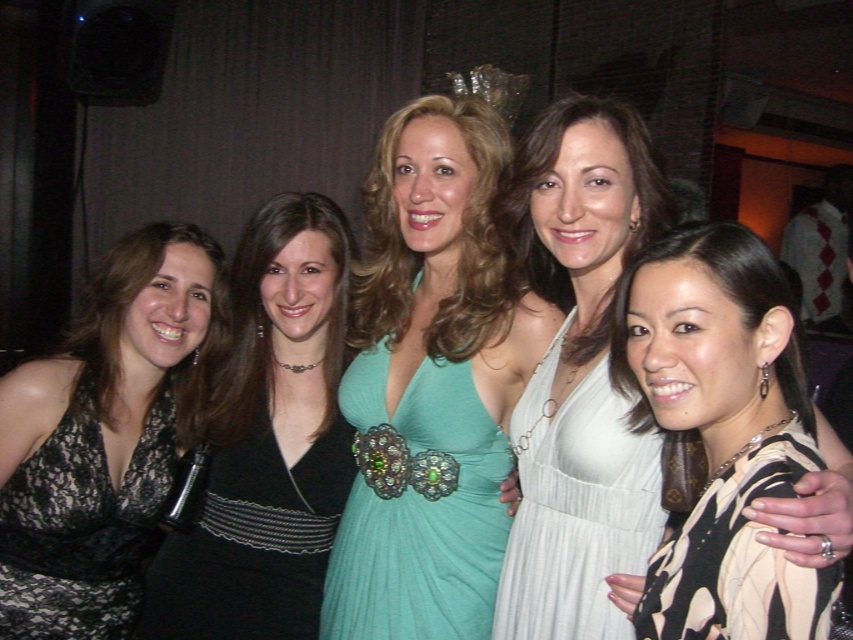
Is white pleated dress at center to the left of printed silk blouse at lower right from the viewer's perspective?

Yes, white pleated dress at center is to the left of printed silk blouse at lower right.

Who is taller, white pleated dress at center or printed silk blouse at lower right?

white pleated dress at center is taller.

I want to click on white pleated dress at center, so click(x=576, y=506).

Identify the location of white pleated dress at center. (576, 506).

Which is more to the left, lace fabric dress at left or printed silk blouse at lower right?

lace fabric dress at left is more to the left.

Who is shorter, lace fabric dress at left or printed silk blouse at lower right?

printed silk blouse at lower right

What do you see at coordinates (80, 529) in the screenshot? This screenshot has height=640, width=853. I see `lace fabric dress at left` at bounding box center [80, 529].

This screenshot has height=640, width=853. I want to click on lace fabric dress at left, so click(80, 529).

Which is more to the left, teal satin dress at center or white pleated dress at center?

teal satin dress at center is more to the left.

Can you confirm if teal satin dress at center is taller than white pleated dress at center?

Correct, teal satin dress at center is much taller as white pleated dress at center.

Identify the location of teal satin dress at center. The image size is (853, 640). (428, 385).

Where is `teal satin dress at center`? teal satin dress at center is located at coordinates (428, 385).